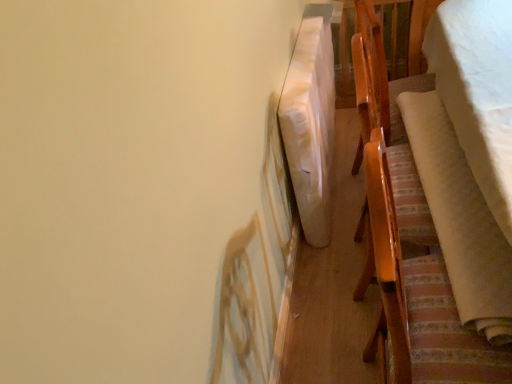
Locate an element on the screen. The height and width of the screenshot is (384, 512). empty space that is ontop of white soft blanket at right, the second blanket when ordered from left to right (from a real-world perspective) is located at coordinates (451, 180).